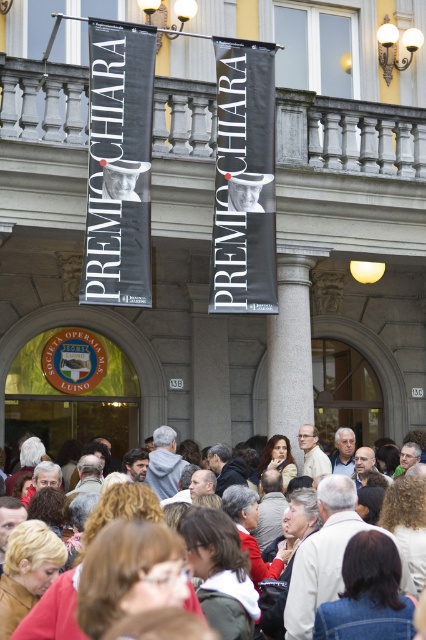
Question: Which point is farther to the camera?

Choices:
 (A) gray marble pillar at center
 (B) black fabric banner at center
 (C) black matte banner at upper left
 (D) multicolored casual attire at center

Answer: (A)

Question: Among these points, which one is farthest from the camera?

Choices:
 (A) (135, 268)
 (B) (224, 276)
 (C) (46, 625)

Answer: (B)

Question: Is gray marble pillar at center above multicolored casual attire at center?

Choices:
 (A) yes
 (B) no

Answer: (A)

Question: Does gray marble pillar at center appear over multicolored casual attire at center?

Choices:
 (A) no
 (B) yes

Answer: (B)

Question: Which of the following is the farthest from the observer?

Choices:
 (A) (132, 276)
 (B) (34, 634)
 (C) (299, 268)
 (D) (273, 259)

Answer: (C)

Question: Can you confirm if black matte banner at upper left is positioned to the right of multicolored casual attire at center?

Choices:
 (A) yes
 (B) no

Answer: (A)